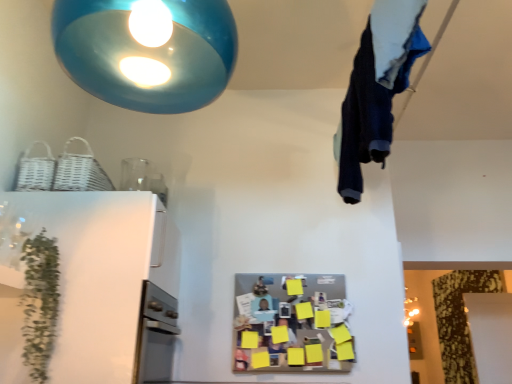
In order to face glossy blue pendant light at upper center, should I rotate leftwards or rightwards?

Turn left by 13.307 degrees to look at glossy blue pendant light at upper center.

Image resolution: width=512 pixels, height=384 pixels. Identify the location of white glossy refrigerator at left. (100, 280).

What is the approximate width of dark blue fabric at upper right?

The width of dark blue fabric at upper right is 7.97 inches.

Locate an element on the screen. The width and height of the screenshot is (512, 384). glossy blue pendant light at upper center is located at coordinates (147, 52).

Which is behind, green leafy plant at left or white glossy refrigerator at left?

white glossy refrigerator at left.

Between green leafy plant at left and white glossy refrigerator at left, which one has larger width?

Wider between the two is white glossy refrigerator at left.

Could you tell me if green leafy plant at left is facing white glossy refrigerator at left?

No, green leafy plant at left is not turned towards white glossy refrigerator at left.

Is glossy blue pendant light at upper center taller or shorter than dark blue fabric at upper right?

Clearly, glossy blue pendant light at upper center is shorter compared to dark blue fabric at upper right.

Which object is closer to the camera, glossy blue pendant light at upper center or dark blue fabric at upper right?

glossy blue pendant light at upper center is closer to the camera.

Is glossy blue pendant light at upper center facing away from dark blue fabric at upper right?

That's not correct — glossy blue pendant light at upper center is not looking away from dark blue fabric at upper right.

Does glossy blue pendant light at upper center touch dark blue fabric at upper right?

No, glossy blue pendant light at upper center is not touching dark blue fabric at upper right.

Considering the relative sizes of dark blue fabric at upper right and glossy blue pendant light at upper center in the image provided, is dark blue fabric at upper right smaller than glossy blue pendant light at upper center?

Yes, dark blue fabric at upper right is smaller than glossy blue pendant light at upper center.

From the image's perspective, is dark blue fabric at upper right below glossy blue pendant light at upper center?

Correct, dark blue fabric at upper right appears lower than glossy blue pendant light at upper center in the image.

Who is taller, dark blue fabric at upper right or glossy blue pendant light at upper center?

With more height is dark blue fabric at upper right.

In terms of width, does dark blue fabric at upper right look wider or thinner when compared to glossy blue pendant light at upper center?

Clearly, dark blue fabric at upper right has less width compared to glossy blue pendant light at upper center.

In the scene shown: Could you tell me if dark blue fabric at upper right is turned towards green leafy plant at left?

No, dark blue fabric at upper right does not turn towards green leafy plant at left.

What's the angular difference between dark blue fabric at upper right and green leafy plant at left's facing directions?

The angle between the facing direction of dark blue fabric at upper right and the facing direction of green leafy plant at left is 0.74 degrees.

Is dark blue fabric at upper right directly adjacent to green leafy plant at left?

dark blue fabric at upper right and green leafy plant at left are clearly separated.

Considering the relative sizes of dark blue fabric at upper right and green leafy plant at left in the image provided, is dark blue fabric at upper right wider than green leafy plant at left?

Yes, dark blue fabric at upper right is wider than green leafy plant at left.

Image resolution: width=512 pixels, height=384 pixels. I want to click on plant beneath the glossy blue pendant light at upper center (from a real-world perspective), so click(40, 303).

How distant is glossy blue pendant light at upper center from green leafy plant at left?

glossy blue pendant light at upper center is 1.12 meters from green leafy plant at left.

From a real-world perspective, relative to green leafy plant at left, is glossy blue pendant light at upper center vertically above or below?

glossy blue pendant light at upper center is situated higher than green leafy plant at left in the real world.

Considering the relative sizes of glossy blue pendant light at upper center and green leafy plant at left in the image provided, is glossy blue pendant light at upper center wider than green leafy plant at left?

Indeed, glossy blue pendant light at upper center has a greater width compared to green leafy plant at left.

Considering the sizes of objects white glossy refrigerator at left and green leafy plant at left in the image provided, who is smaller, white glossy refrigerator at left or green leafy plant at left?

green leafy plant at left is smaller.

Which is farther from the camera, (x=25, y=223) or (x=25, y=287)?

The point (x=25, y=223) is more distant.

Considering the relative positions of white glossy refrigerator at left and green leafy plant at left in the image provided, is white glossy refrigerator at left to the left of green leafy plant at left from the viewer's perspective?

In fact, white glossy refrigerator at left is to the right of green leafy plant at left.

Is point (86, 284) closer or farther from the camera than point (182, 36)?

Point (86, 284) is farther from the camera than point (182, 36).

In the scene shown: Is white glossy refrigerator at left looking in the opposite direction of glossy blue pendant light at upper center?

No.

Is white glossy refrigerator at left next to glossy blue pendant light at upper center and touching it?

There is a gap between white glossy refrigerator at left and glossy blue pendant light at upper center.

Where is `appliance behind the glossy blue pendant light at upper center`? appliance behind the glossy blue pendant light at upper center is located at coordinates (100, 280).

This screenshot has height=384, width=512. I want to click on appliance below the green leafy plant at left (from the image's perspective), so click(x=100, y=280).

I want to click on laundry below the glossy blue pendant light at upper center (from a real-world perspective), so click(x=377, y=88).

Based on the photo, looking at the image, which one is located closer to dark blue fabric at upper right, glossy blue pendant light at upper center or green leafy plant at left?

The object closer to dark blue fabric at upper right is glossy blue pendant light at upper center.

Looking at the image, which one is located further to white glossy refrigerator at left, glossy blue pendant light at upper center or dark blue fabric at upper right?

glossy blue pendant light at upper center is further to white glossy refrigerator at left.

Looking at the image, which one is located closer to glossy blue pendant light at upper center, dark blue fabric at upper right or white glossy refrigerator at left?

dark blue fabric at upper right.

Based on the photo, which object lies nearer to the anchor point white glossy refrigerator at left, dark blue fabric at upper right or green leafy plant at left?

The object closer to white glossy refrigerator at left is green leafy plant at left.

Estimate the real-world distances between objects in this image. Which object is closer to glossy blue pendant light at upper center, green leafy plant at left or dark blue fabric at upper right?

dark blue fabric at upper right is closer to glossy blue pendant light at upper center.

Looking at the image, which one is located further to green leafy plant at left, glossy blue pendant light at upper center or dark blue fabric at upper right?

Among the two, dark blue fabric at upper right is located further to green leafy plant at left.

Looking at the image, which one is located further to glossy blue pendant light at upper center, green leafy plant at left or white glossy refrigerator at left?

green leafy plant at left lies further to glossy blue pendant light at upper center than the other object.

Looking at the image, which one is located closer to glossy blue pendant light at upper center, white glossy refrigerator at left or dark blue fabric at upper right?

dark blue fabric at upper right.

Where is `lamp situated between green leafy plant at left and dark blue fabric at upper right from left to right`? This screenshot has width=512, height=384. lamp situated between green leafy plant at left and dark blue fabric at upper right from left to right is located at coordinates (147, 52).

You are a GUI agent. You are given a task and a screenshot of the screen. Output one action in this format:
    pyautogui.click(x=<x>, y=<y>)
    Task: Click on the plant that lies between glossy blue pendant light at upper center and white glossy refrigerator at left from top to bottom
    The width and height of the screenshot is (512, 384).
    Given the screenshot: What is the action you would take?
    pyautogui.click(x=40, y=303)

Where is `lamp situated between white glossy refrigerator at left and dark blue fabric at upper right from left to right`? Image resolution: width=512 pixels, height=384 pixels. lamp situated between white glossy refrigerator at left and dark blue fabric at upper right from left to right is located at coordinates (147, 52).

In order to click on appliance between green leafy plant at left and dark blue fabric at upper right in this screenshot , I will do `click(100, 280)`.